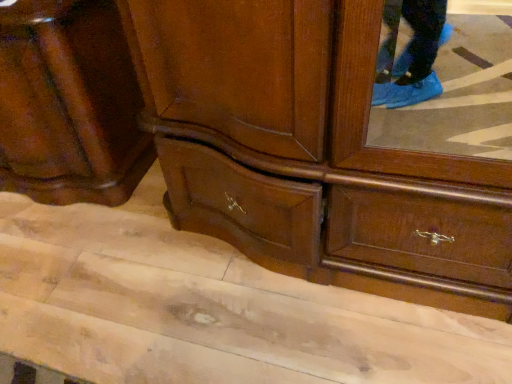
The height and width of the screenshot is (384, 512). I want to click on matte wood cupboard at lower left, so click(x=69, y=104).

What do you see at coordinates (69, 104) in the screenshot? Image resolution: width=512 pixels, height=384 pixels. I see `matte wood cupboard at lower left` at bounding box center [69, 104].

Identify the location of matte wood cupboard at lower left. (69, 104).